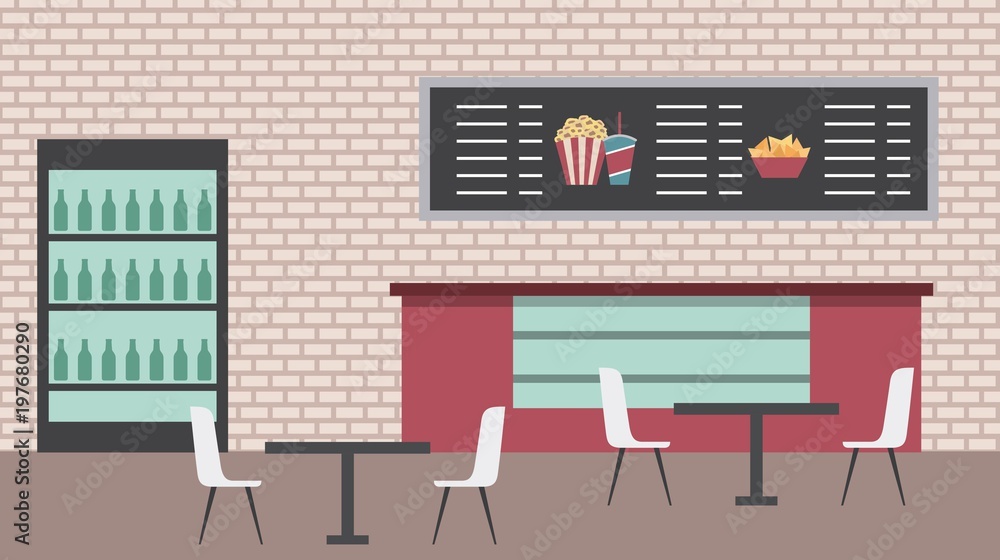
The width and height of the screenshot is (1000, 560). In order to click on bottles in this screenshot , I will do `click(178, 350)`, `click(115, 276)`, `click(86, 200)`.